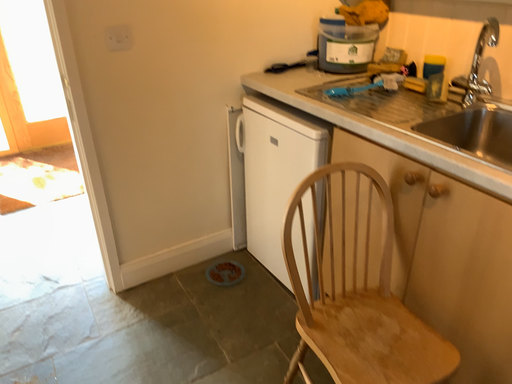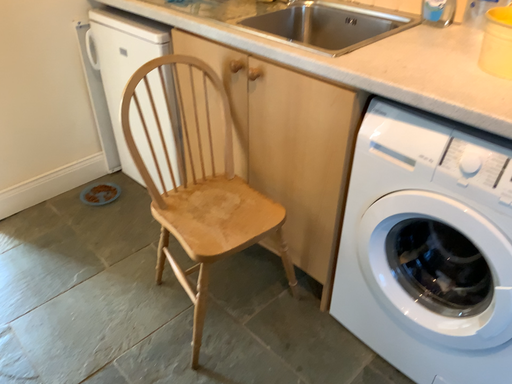
Question: Which way did the camera rotate in the video?

Choices:
 (A) rotated right
 (B) rotated left

Answer: (A)